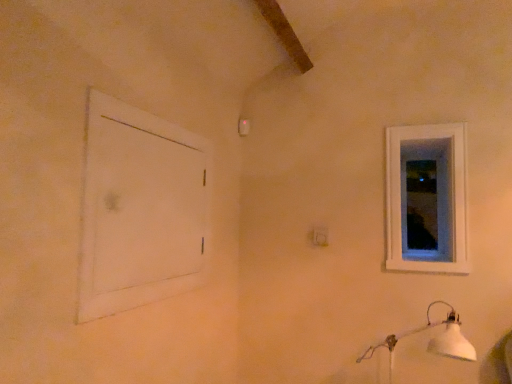
Question: Should I look upward or downward to see white matte door at left?

Choices:
 (A) up
 (B) down

Answer: (B)

Question: From the image's perspective, is white plastic electric outlet at center below white wooden window at upper right?

Choices:
 (A) no
 (B) yes

Answer: (B)

Question: Is white plastic electric outlet at center far away from white wooden window at upper right?

Choices:
 (A) yes
 (B) no

Answer: (B)

Question: Is white plastic electric outlet at center aimed at white wooden window at upper right?

Choices:
 (A) yes
 (B) no

Answer: (B)

Question: Can you confirm if white plastic electric outlet at center is shorter than white wooden window at upper right?

Choices:
 (A) no
 (B) yes

Answer: (B)

Question: Does white plastic electric outlet at center have a lesser width compared to white wooden window at upper right?

Choices:
 (A) yes
 (B) no

Answer: (B)

Question: From a real-world perspective, is white plastic electric outlet at center physically below white wooden window at upper right?

Choices:
 (A) yes
 (B) no

Answer: (A)

Question: Is transparent glass window at upper right smaller than white plastic electric outlet at center?

Choices:
 (A) yes
 (B) no

Answer: (B)

Question: Does transparent glass window at upper right appear on the right side of white plastic electric outlet at center?

Choices:
 (A) no
 (B) yes

Answer: (B)

Question: Can you confirm if transparent glass window at upper right is thinner than white plastic electric outlet at center?

Choices:
 (A) no
 (B) yes

Answer: (A)

Question: Is transparent glass window at upper right bigger than white plastic electric outlet at center?

Choices:
 (A) yes
 (B) no

Answer: (A)

Question: Is transparent glass window at upper right not near white plastic electric outlet at center?

Choices:
 (A) yes
 (B) no

Answer: (B)

Question: From a real-world perspective, is transparent glass window at upper right below white plastic electric outlet at center?

Choices:
 (A) yes
 (B) no

Answer: (B)

Question: Does white matte lamp at lower right have a greater width compared to white wooden window at upper right?

Choices:
 (A) yes
 (B) no

Answer: (A)